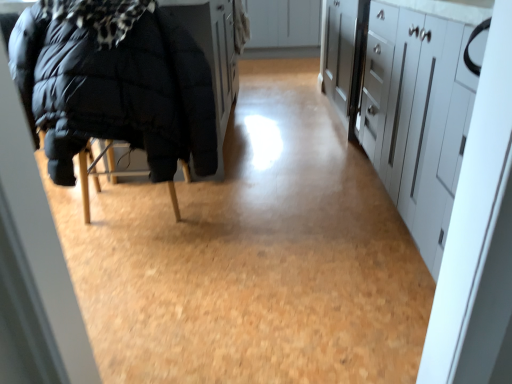
Question: Is white glossy cabinets at right, arranged as the 2th cabinetry when viewed from the top, positioned in front of black puffy jacket at left?

Choices:
 (A) no
 (B) yes

Answer: (B)

Question: Does white glossy cabinets at right, the first cabinetry from the front, have a greater height compared to black puffy jacket at left?

Choices:
 (A) yes
 (B) no

Answer: (A)

Question: Considering the relative sizes of white glossy cabinets at right, arranged as the 2th cabinetry when viewed from the top, and black puffy jacket at left in the image provided, is white glossy cabinets at right, arranged as the 2th cabinetry when viewed from the top, wider than black puffy jacket at left?

Choices:
 (A) no
 (B) yes

Answer: (B)

Question: Considering the relative positions of white glossy cabinets at right, the first cabinetry from the front, and black puffy jacket at left in the image provided, is white glossy cabinets at right, the first cabinetry from the front, behind black puffy jacket at left?

Choices:
 (A) yes
 (B) no

Answer: (B)

Question: Does white glossy cabinets at right, positioned as the second cabinetry in back-to-front order, have a lesser height compared to black puffy jacket at left?

Choices:
 (A) yes
 (B) no

Answer: (B)

Question: Is white matte cabinet at upper center, the 1th cabinetry positioned from the back, to the left or to the right of black puffy jacket at left in the image?

Choices:
 (A) right
 (B) left

Answer: (A)

Question: From the image's perspective, relative to black puffy jacket at left, is white matte cabinet at upper center, placed as the 1th cabinetry when sorted from top to bottom, above or below?

Choices:
 (A) below
 (B) above

Answer: (B)

Question: From a real-world perspective, is white matte cabinet at upper center, the second cabinetry when ordered from front to back, above or below black puffy jacket at left?

Choices:
 (A) above
 (B) below

Answer: (B)

Question: Looking at their shapes, would you say white matte cabinet at upper center, which is counted as the second cabinetry, starting from the bottom, is wider or thinner than black puffy jacket at left?

Choices:
 (A) thin
 (B) wide

Answer: (B)

Question: From a real-world perspective, relative to white glossy cabinets at right, arranged as the 2th cabinetry when viewed from the top, is black puffy jacket at left vertically above or below?

Choices:
 (A) above
 (B) below

Answer: (A)

Question: Is black puffy jacket at left situated inside white glossy cabinets at right, which is the first cabinetry in bottom-to-top order, or outside?

Choices:
 (A) inside
 (B) outside

Answer: (B)

Question: Is black puffy jacket at left to the left or to the right of white glossy cabinets at right, arranged as the 2th cabinetry when viewed from the top, in the image?

Choices:
 (A) left
 (B) right

Answer: (A)

Question: From the image's perspective, is black puffy jacket at left positioned above or below white glossy cabinets at right, which is the first cabinetry in bottom-to-top order?

Choices:
 (A) above
 (B) below

Answer: (A)

Question: Is white glossy cabinets at right, the first cabinetry from the front, wider or thinner than black puffy jacket at left?

Choices:
 (A) thin
 (B) wide

Answer: (B)

Question: From the image's perspective, is white glossy cabinets at right, which is the first cabinetry in bottom-to-top order, located above or below black puffy jacket at left?

Choices:
 (A) above
 (B) below

Answer: (B)